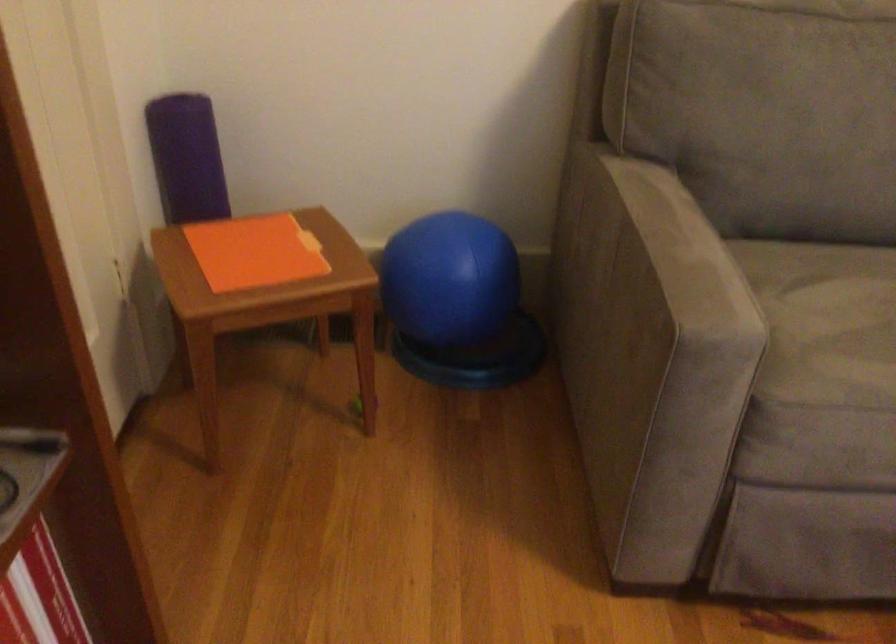
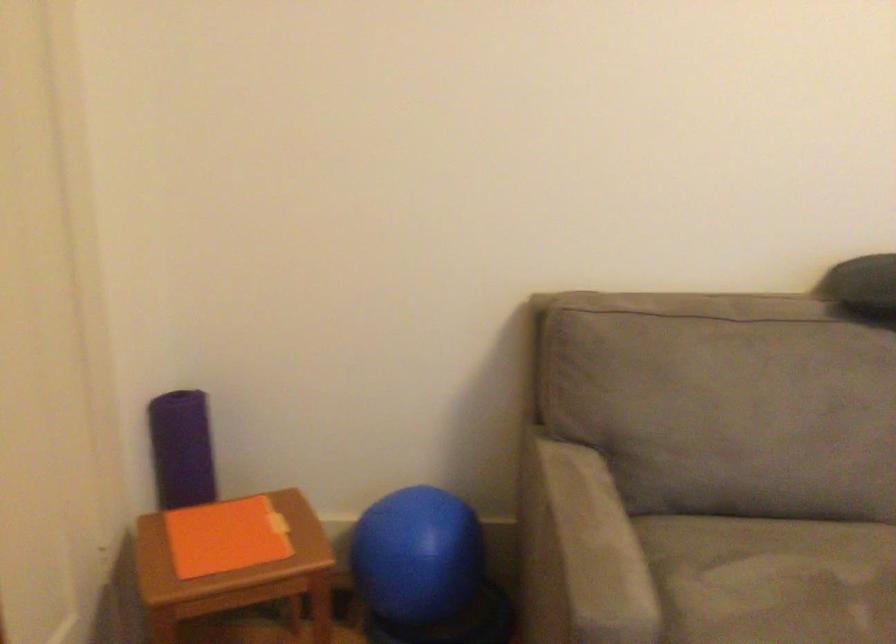
Find the pixel in the second image that matches (x=255, y=252) in the first image.

(226, 536)